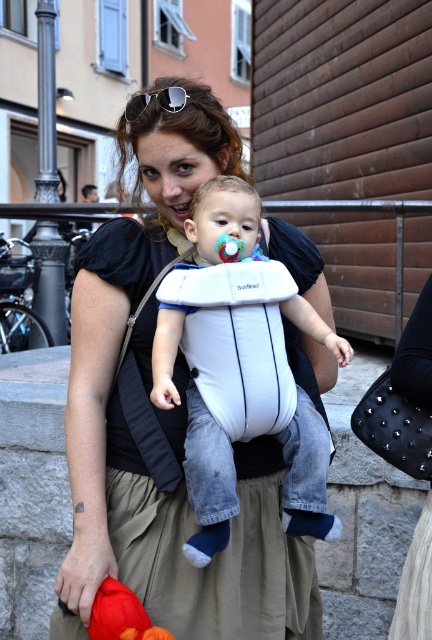
Between matte black shirt at center and rubber/soft pacifier at center, which one is positioned higher?

rubber/soft pacifier at center is higher up.

Does point (275, 614) come closer to viewer compared to point (219, 257)?

That is False.

The width and height of the screenshot is (432, 640). I want to click on matte black shirt at center, so click(134, 442).

Is white fabric baby carrier at center bigger than rubber/soft pacifier at center?

Yes, white fabric baby carrier at center is bigger than rubber/soft pacifier at center.

Is white fabric baby carrier at center wider than rubber/soft pacifier at center?

Yes, white fabric baby carrier at center is wider than rubber/soft pacifier at center.

Which is in front, point (197, 208) or point (226, 253)?

Point (226, 253)

Locate an element on the screen. The height and width of the screenshot is (640, 432). white fabric baby carrier at center is located at coordinates (240, 371).

Which is below, white fabric baby carrier at center or metallic reflective sunglasses at upper center?

Positioned lower is white fabric baby carrier at center.

Between white fabric baby carrier at center and metallic reflective sunglasses at upper center, which one is positioned higher?

metallic reflective sunglasses at upper center

Is point (168, 301) closer to camera compared to point (130, 100)?

Yes, point (168, 301) is in front of point (130, 100).

This screenshot has height=640, width=432. Find the location of `white fabric baby carrier at center`. white fabric baby carrier at center is located at coordinates (240, 371).